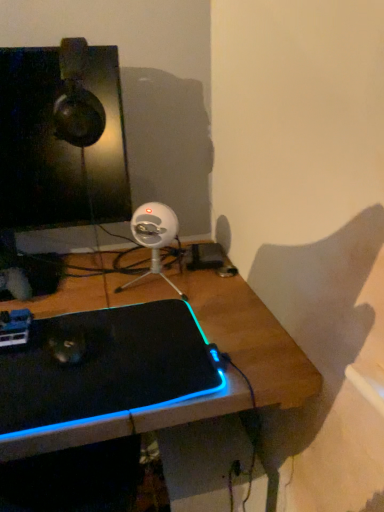
Question: Can you confirm if black matte laptop at center is shorter than matte black monitor at upper left?

Choices:
 (A) no
 (B) yes

Answer: (B)

Question: Is black matte laptop at center taller than matte black monitor at upper left?

Choices:
 (A) no
 (B) yes

Answer: (A)

Question: Is black matte laptop at center positioned in front of matte black monitor at upper left?

Choices:
 (A) no
 (B) yes

Answer: (B)

Question: Is black matte laptop at center behind matte black monitor at upper left?

Choices:
 (A) yes
 (B) no

Answer: (B)

Question: Considering the relative sizes of black matte laptop at center and matte black monitor at upper left in the image provided, is black matte laptop at center wider than matte black monitor at upper left?

Choices:
 (A) yes
 (B) no

Answer: (A)

Question: Would you say black matte laptop at center is inside or outside matte black monitor at upper left?

Choices:
 (A) inside
 (B) outside

Answer: (B)

Question: Is black matte laptop at center to the left or to the right of matte black monitor at upper left in the image?

Choices:
 (A) left
 (B) right

Answer: (B)

Question: Is point (48, 373) closer or farther from the camera than point (51, 116)?

Choices:
 (A) closer
 (B) farther

Answer: (A)

Question: Considering the positions of black matte laptop at center and matte black monitor at upper left in the image, is black matte laptop at center taller or shorter than matte black monitor at upper left?

Choices:
 (A) tall
 (B) short

Answer: (B)

Question: Is point (135, 278) closer or farther from the camera than point (122, 164)?

Choices:
 (A) farther
 (B) closer

Answer: (A)

Question: Considering the positions of white plastic webcam at center and matte black monitor at upper left in the image, is white plastic webcam at center taller or shorter than matte black monitor at upper left?

Choices:
 (A) tall
 (B) short

Answer: (B)

Question: From a real-world perspective, is white plastic webcam at center above or below matte black monitor at upper left?

Choices:
 (A) above
 (B) below

Answer: (B)

Question: From the image's perspective, relative to matte black monitor at upper left, is white plastic webcam at center above or below?

Choices:
 (A) below
 (B) above

Answer: (A)

Question: In terms of size, does white plastic webcam at center appear bigger or smaller than black matte laptop at center?

Choices:
 (A) big
 (B) small

Answer: (B)

Question: From the image's perspective, relative to black matte laptop at center, is white plastic webcam at center above or below?

Choices:
 (A) below
 (B) above

Answer: (B)